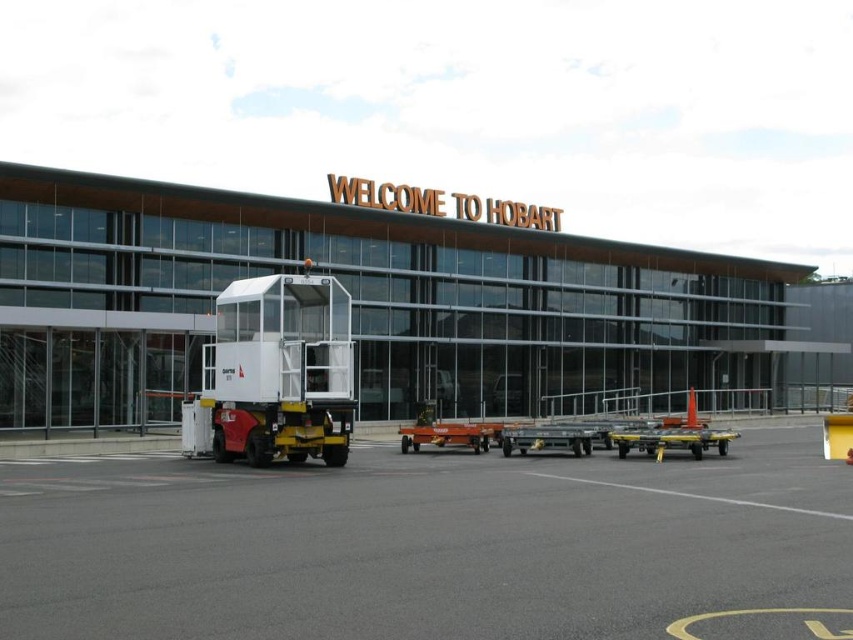
Question: Where is matte glass airport terminal at center located in relation to white plastic truck at center in the image?

Choices:
 (A) below
 (B) above

Answer: (A)

Question: Does gray asphalt tarmac at center appear on the left side of white plastic truck at center?

Choices:
 (A) no
 (B) yes

Answer: (A)

Question: Based on their relative distances, which object is nearer to the matte glass airport terminal at center?

Choices:
 (A) white plastic truck at center
 (B) gray asphalt tarmac at center

Answer: (B)

Question: Among these objects, which one is farthest from the camera?

Choices:
 (A) matte glass airport terminal at center
 (B) white plastic truck at center
 (C) gray asphalt tarmac at center

Answer: (A)

Question: From the image, what is the correct spatial relationship of gray asphalt tarmac at center in relation to white plastic truck at center?

Choices:
 (A) right
 (B) left

Answer: (A)

Question: Which of the following is the farthest from the observer?

Choices:
 (A) white plastic truck at center
 (B) matte glass airport terminal at center
 (C) gray asphalt tarmac at center

Answer: (B)